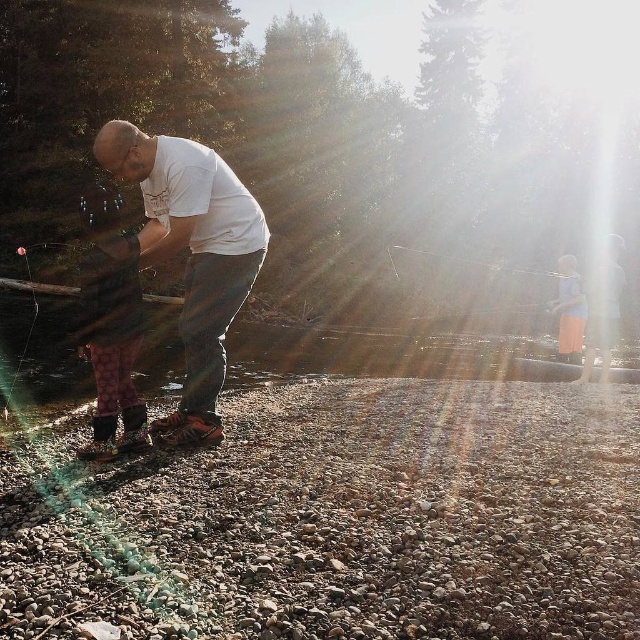
Question: Can you confirm if patterned fabric pants at left is positioned to the right of light blue fabric dress at right?

Choices:
 (A) no
 (B) yes

Answer: (A)

Question: In this image, where is patterned fabric pants at left located relative to light blue fabric dress at right?

Choices:
 (A) above
 (B) below

Answer: (B)

Question: Considering the real-world distances, which object is closest to the white matte shirt at center?

Choices:
 (A) light blue fabric dress at right
 (B) patterned fabric pants at left

Answer: (B)

Question: Does white matte shirt at center have a lesser width compared to light blue fabric dress at right?

Choices:
 (A) no
 (B) yes

Answer: (B)

Question: Which point is farther from the camera taking this photo?

Choices:
 (A) (582, 317)
 (B) (218, 326)

Answer: (A)

Question: Which of these objects is positioned farthest from the patterned fabric pants at left?

Choices:
 (A) white matte shirt at center
 (B) light blue fabric dress at right

Answer: (B)